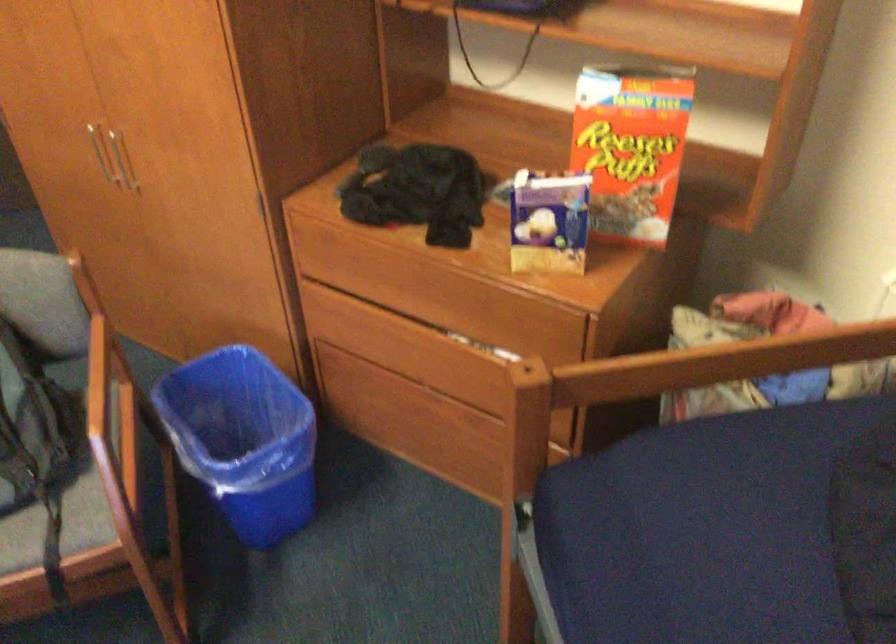
Identify the location of backpack strap. (55, 576).